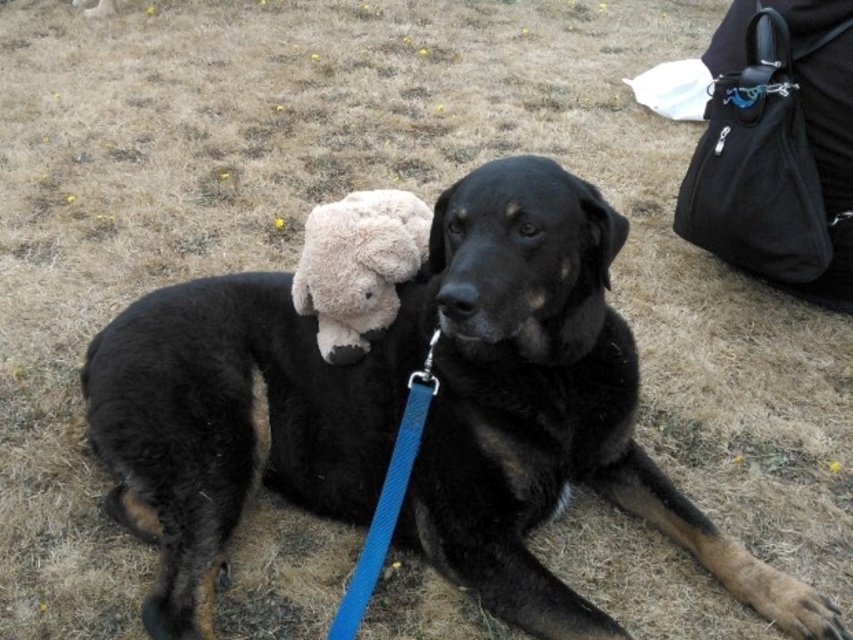
Is point (267, 275) more distant than point (376, 253)?

Yes, it is behind point (376, 253).

Identify the location of black soft fur dog at center. The width and height of the screenshot is (853, 640). (401, 412).